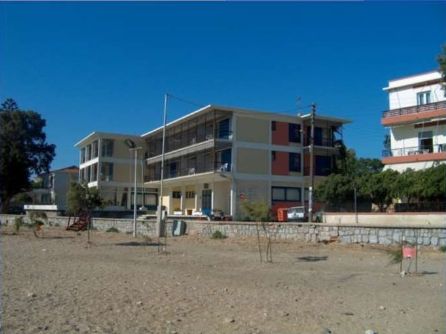
Find the location of a particular element. The width and height of the screenshot is (446, 334). wall is located at coordinates (239, 135).